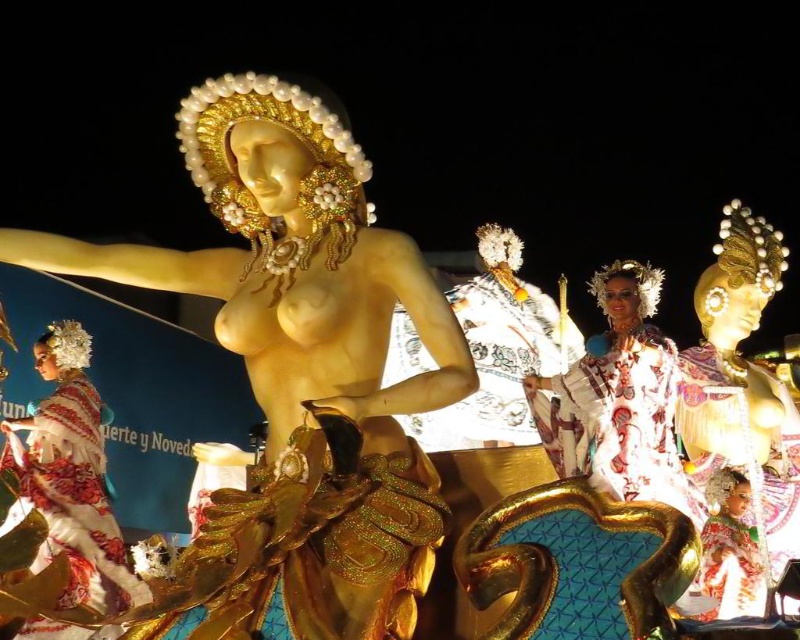
Question: Is gold polished statue at center bigger than embroidered silk dress at lower left?

Choices:
 (A) yes
 (B) no

Answer: (A)

Question: Can you confirm if gold polished statue at center is positioned to the right of embroidered silk dress at lower left?

Choices:
 (A) no
 (B) yes

Answer: (B)

Question: Can you confirm if gold metallic statue at center is smaller than embroidered silk dress at lower left?

Choices:
 (A) yes
 (B) no

Answer: (B)

Question: Which object is closer to the camera taking this photo?

Choices:
 (A) gold polished statue at center
 (B) gold metallic statue at center

Answer: (A)

Question: Considering the real-world distances, which object is farthest from the gold metallic statue at center?

Choices:
 (A) gold polished statue at center
 (B) embroidered silk dress at lower left

Answer: (B)

Question: Considering the real-world distances, which object is farthest from the gold metallic statue at center?

Choices:
 (A) embroidered silk dress at lower left
 (B) gold polished statue at center

Answer: (A)